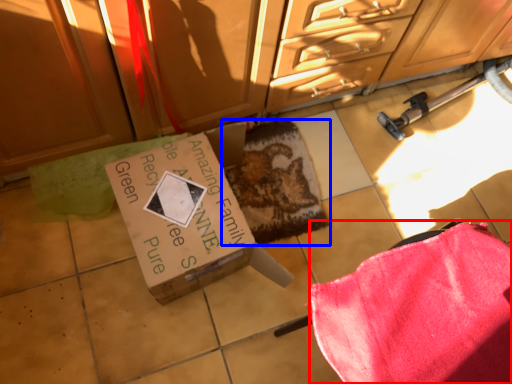
Question: Which object is closer to the camera taking this photo, blanket (highlighted by a red box) or mat (highlighted by a blue box)?

Choices:
 (A) blanket
 (B) mat

Answer: (A)